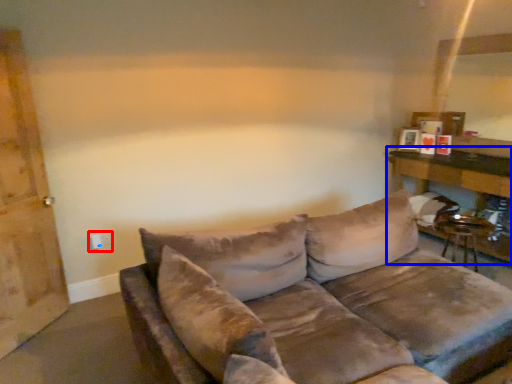
Question: Among these objects, which one is farthest to the camera, electric outlet (highlighted by a red box) or table (highlighted by a blue box)?

Choices:
 (A) electric outlet
 (B) table

Answer: (A)